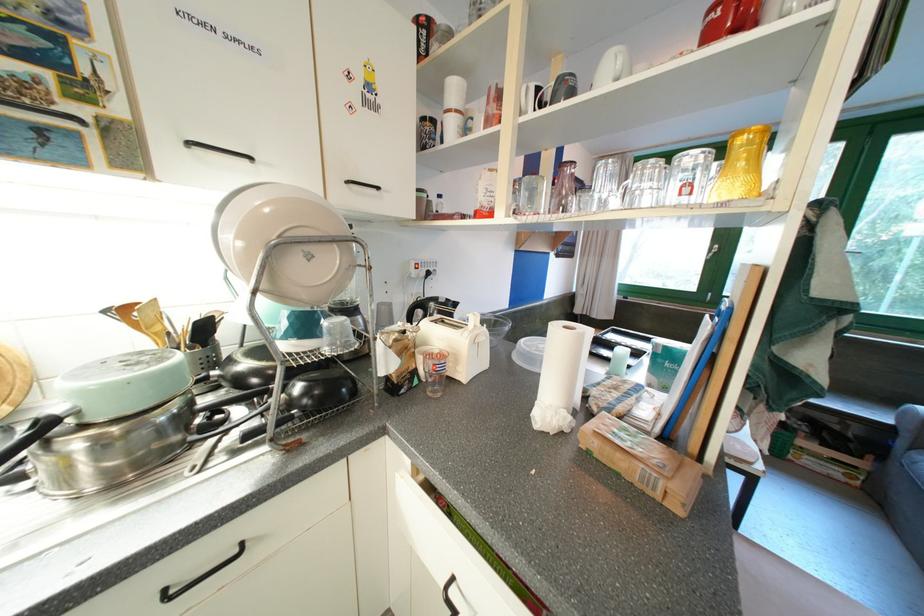
Describe the element at coordinates (37, 430) in the screenshot. I see `a black kettle handle` at that location.